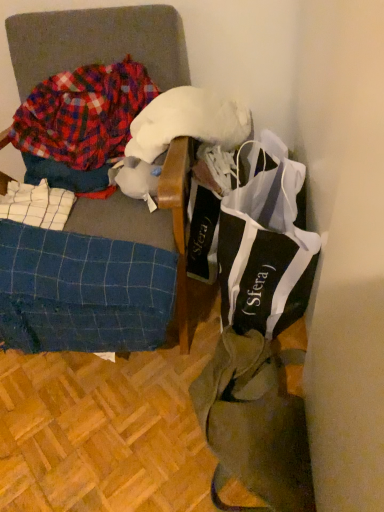
Question: Should I look upward or downward to see blue checkered fabric at lower left?

Choices:
 (A) up
 (B) down

Answer: (B)

Question: Is black and white fabric bag at right aimed at blue plaid fabric at left?

Choices:
 (A) no
 (B) yes

Answer: (A)

Question: Does black and white fabric bag at right lie behind blue plaid fabric at left?

Choices:
 (A) yes
 (B) no

Answer: (A)

Question: Are black and white fabric bag at right and blue plaid fabric at left located far from each other?

Choices:
 (A) no
 (B) yes

Answer: (A)

Question: Is black and white fabric bag at right not within blue plaid fabric at left?

Choices:
 (A) no
 (B) yes

Answer: (B)

Question: From the image's perspective, is black and white fabric bag at right on blue plaid fabric at left?

Choices:
 (A) no
 (B) yes

Answer: (A)

Question: Does black and white fabric bag at right have a smaller size compared to blue plaid fabric at left?

Choices:
 (A) yes
 (B) no

Answer: (A)

Question: Would you say blue checkered fabric at lower left contains olive green canvas tote bag at lower right?

Choices:
 (A) no
 (B) yes

Answer: (A)

Question: Does blue checkered fabric at lower left have a greater width compared to olive green canvas tote bag at lower right?

Choices:
 (A) no
 (B) yes

Answer: (A)

Question: Can you confirm if blue checkered fabric at lower left is positioned to the right of olive green canvas tote bag at lower right?

Choices:
 (A) no
 (B) yes

Answer: (A)

Question: Is blue checkered fabric at lower left positioned in front of olive green canvas tote bag at lower right?

Choices:
 (A) no
 (B) yes

Answer: (A)

Question: Is blue checkered fabric at lower left smaller than olive green canvas tote bag at lower right?

Choices:
 (A) no
 (B) yes

Answer: (A)

Question: Is blue checkered fabric at lower left further to the viewer compared to olive green canvas tote bag at lower right?

Choices:
 (A) no
 (B) yes

Answer: (B)

Question: Is olive green canvas tote bag at lower right at the right side of plaid flannel shirt at left?

Choices:
 (A) no
 (B) yes

Answer: (B)